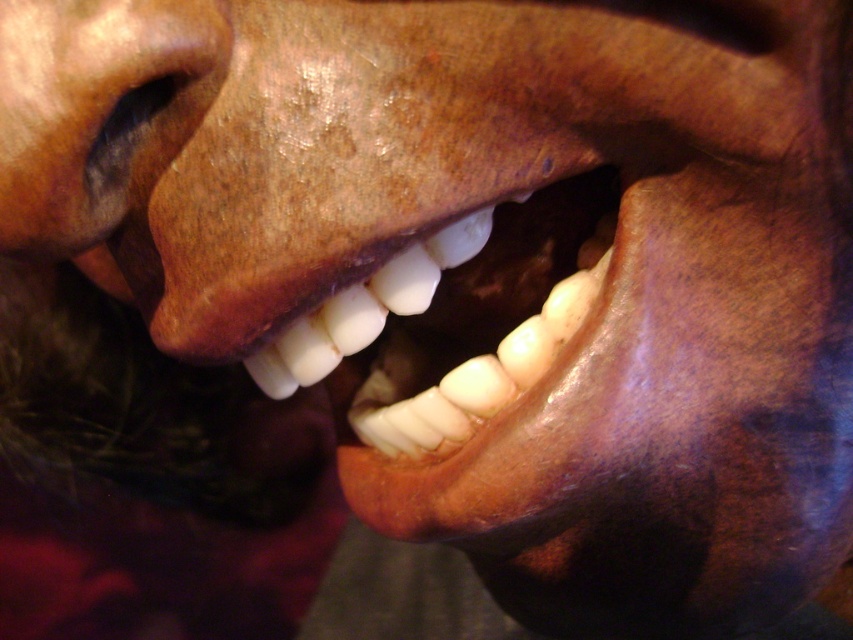
Can you confirm if white glossy teeth at center is wider than matte brown nose at center?

Correct, the width of white glossy teeth at center exceeds that of matte brown nose at center.

Measure the distance from white glossy teeth at center to matte brown nose at center.

white glossy teeth at center and matte brown nose at center are 5.38 inches apart from each other.

Which is behind, point (316, 314) or point (57, 221)?

The point (316, 314) is behind.

This screenshot has width=853, height=640. I want to click on white glossy teeth at center, so [461, 321].